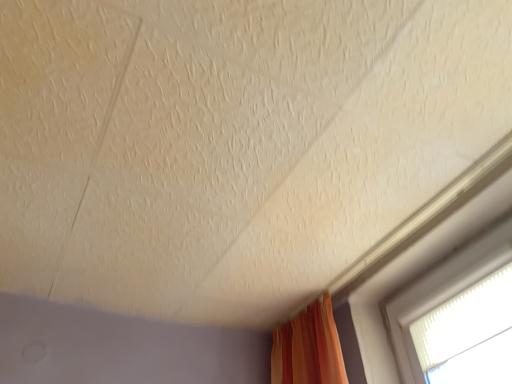
What is the approximate height of white textured window at upper right?

The height of white textured window at upper right is 27.82 centimeters.

In order to click on white textured window at upper right in this screenshot , I will do `click(458, 317)`.

This screenshot has height=384, width=512. What do you see at coordinates (458, 317) in the screenshot?
I see `white textured window at upper right` at bounding box center [458, 317].

Find the location of a particular element. This screenshot has height=384, width=512. white textured window at upper right is located at coordinates (458, 317).